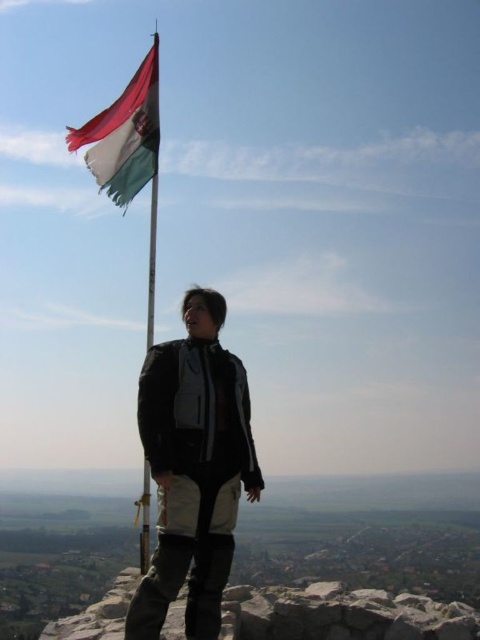
Question: Estimate the real-world distances between objects in this image. Which object is closer to the tri-color fabric flag at upper left?

Choices:
 (A) metallic flagpole at upper left
 (B) black matte jacket at center

Answer: (B)

Question: Does tri-color fabric flag at upper left have a larger size compared to metallic flagpole at upper left?

Choices:
 (A) no
 (B) yes

Answer: (A)

Question: Which of the following is the closest to the observer?

Choices:
 (A) (425, 627)
 (B) (168, 396)
 (C) (148, 314)
 (D) (149, 134)

Answer: (B)

Question: Is black matte jacket at center thinner than metallic flagpole at upper left?

Choices:
 (A) no
 (B) yes

Answer: (B)

Question: Is rough stone at lower center in front of metallic flagpole at upper left?

Choices:
 (A) no
 (B) yes

Answer: (B)

Question: Which object appears farthest from the camera in this image?

Choices:
 (A) tri-color fabric flag at upper left
 (B) rough stone at lower center
 (C) metallic flagpole at upper left
 (D) black matte jacket at center

Answer: (A)